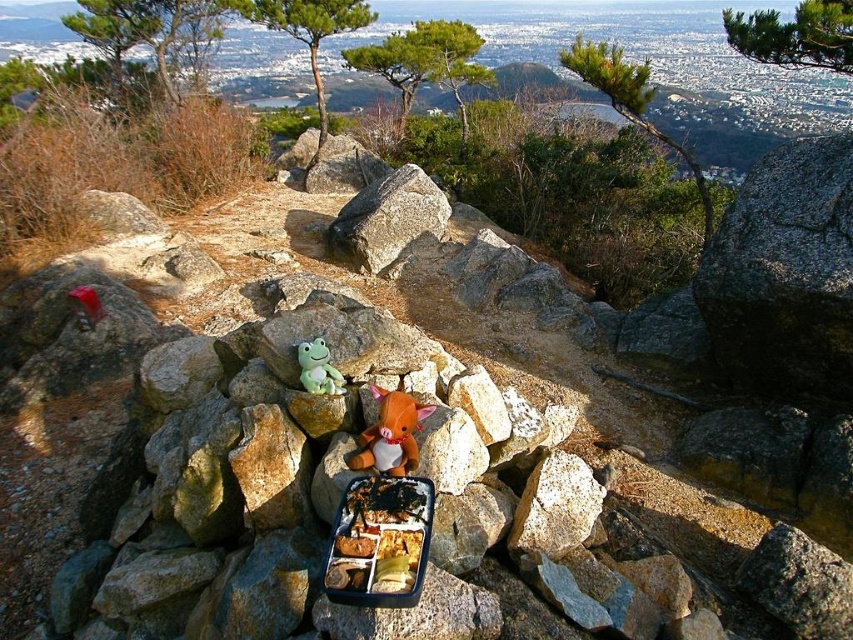
Which is more to the left, gray rough rock at center or green plush frog at center?

From the viewer's perspective, gray rough rock at center appears more on the left side.

Is gray rough rock at center below green plush frog at center?

No.

Describe the element at coordinates (387, 220) in the screenshot. I see `gray rough rock at center` at that location.

This screenshot has width=853, height=640. Find the location of `gray rough rock at center`. gray rough rock at center is located at coordinates (387, 220).

Is point (376, 273) in front of point (386, 390)?

No, it is not.

Identify the location of gray rough rock at center. The image size is (853, 640). (387, 220).

I want to click on gray rough rock at center, so click(x=387, y=220).

Which is in front, point (851, 340) or point (407, 394)?

Point (407, 394) is more forward.

Who is shorter, gray granite rock at center or brown plush toy at center?

With less height is brown plush toy at center.

You are a GUI agent. You are given a task and a screenshot of the screen. Output one action in this format:
    pyautogui.click(x=<x>, y=<y>)
    Task: Click on the gray granite rock at center
    
    Given the screenshot: What is the action you would take?
    coord(784,273)

Find the location of a particular element. The width and height of the screenshot is (853, 640). gray granite rock at center is located at coordinates (784, 273).